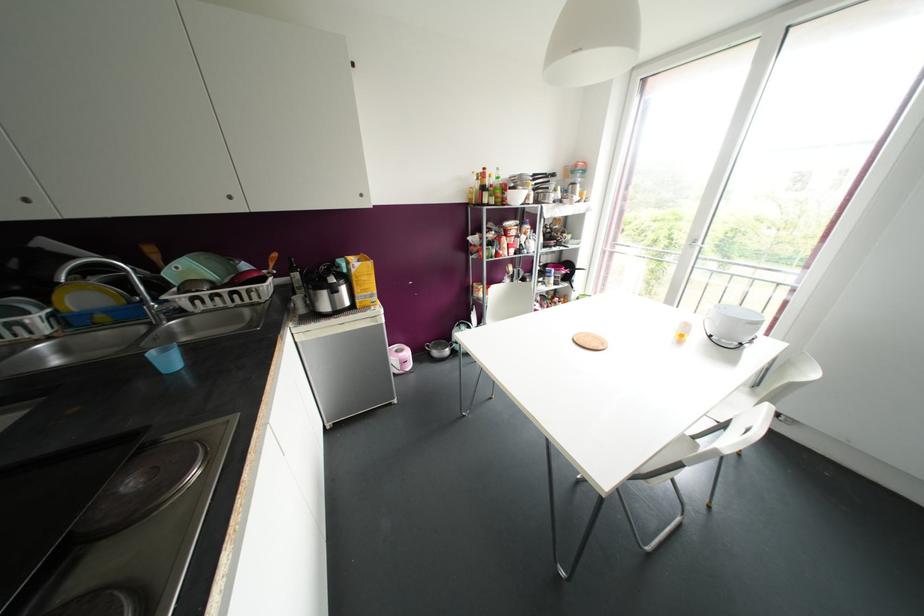
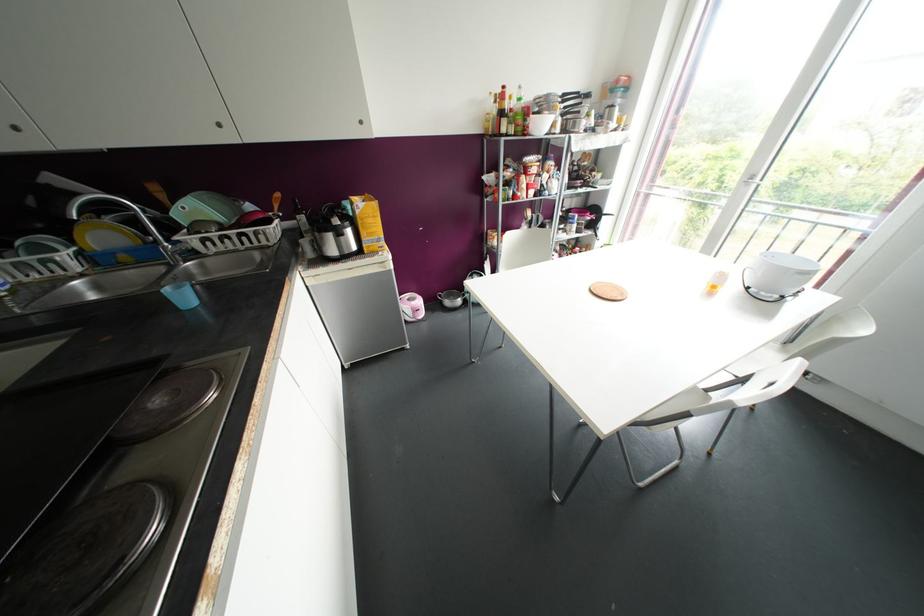
Where in the second image is the point corresponding to pixel 168 361 from the first image?

(184, 297)